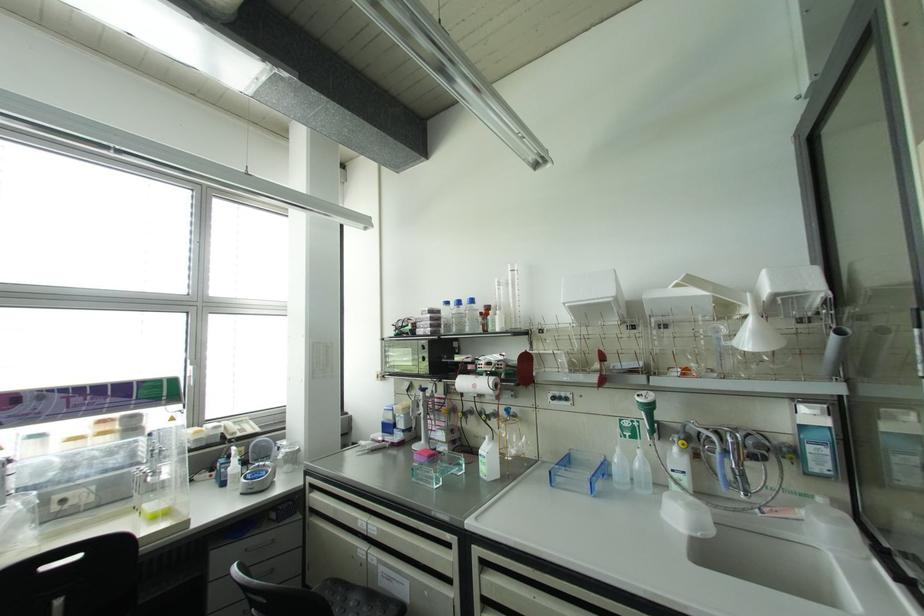
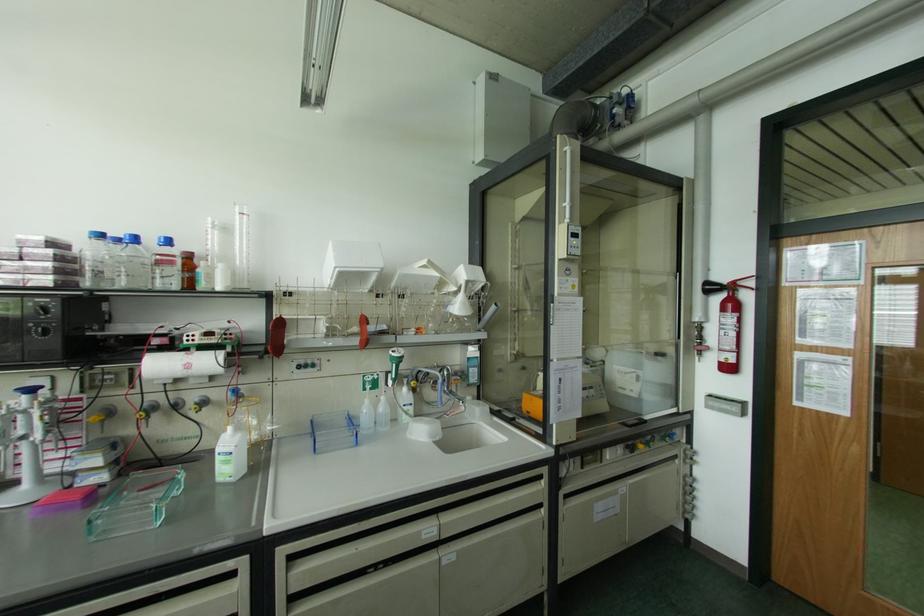
Locate, in the second image, the point that corresponds to point 494,415 in the first image.

(203, 402)